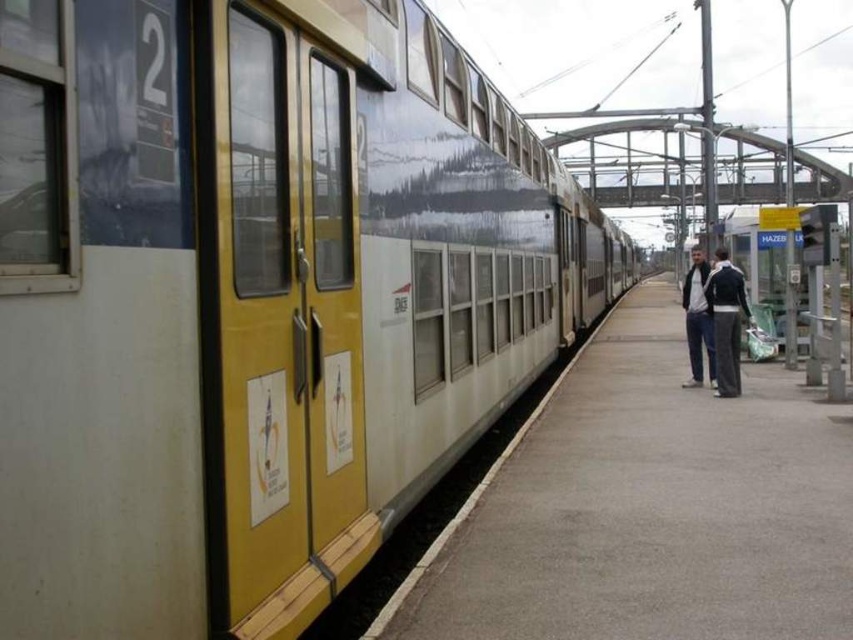
Question: Which point appears farthest from the camera in this image?

Choices:
 (A) tap(704, 260)
 (B) tap(718, 369)
 (C) tap(670, 428)

Answer: (A)

Question: Which object is closer to the camera taking this photo?

Choices:
 (A) dark blue jacket at center
 (B) dark blue jeans at right

Answer: (A)

Question: Does smooth concrete platform at center have a smaller size compared to dark blue jacket at center?

Choices:
 (A) no
 (B) yes

Answer: (A)

Question: Is dark blue jacket at center to the left of dark blue jeans at right from the viewer's perspective?

Choices:
 (A) yes
 (B) no

Answer: (A)

Question: Which object is farther from the camera taking this photo?

Choices:
 (A) dark blue jeans at right
 (B) dark blue jacket at center

Answer: (A)

Question: Is dark blue jacket at center wider than dark blue jeans at right?

Choices:
 (A) yes
 (B) no

Answer: (B)